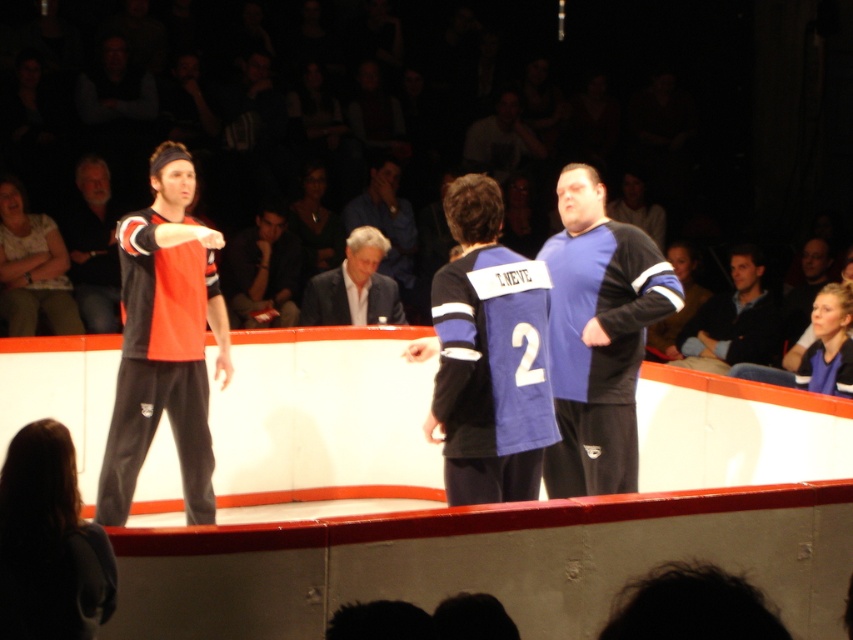
Question: Does matte black shirt at center have a lesser width compared to blue jersey at center?

Choices:
 (A) no
 (B) yes

Answer: (A)

Question: Which of the following is the farthest from the observer?

Choices:
 (A) blue jersey at center
 (B) dark gray fabric jacket at center
 (C) dark green jersey at center

Answer: (C)

Question: Is blue jersey at center closer to camera compared to dark gray fabric jacket at center?

Choices:
 (A) no
 (B) yes

Answer: (B)

Question: Which of the following is the farthest from the observer?

Choices:
 (A) (346, 266)
 (B) (764, 326)
 (C) (264, 278)
 (D) (42, 296)

Answer: (C)

Question: In this image, where is white textured shirt at left located relative to matte black shirt at left?

Choices:
 (A) right
 (B) left

Answer: (B)

Question: Among these objects, which one is farthest from the camera?

Choices:
 (A) matte black shirt at left
 (B) dark blue sweater at right

Answer: (A)